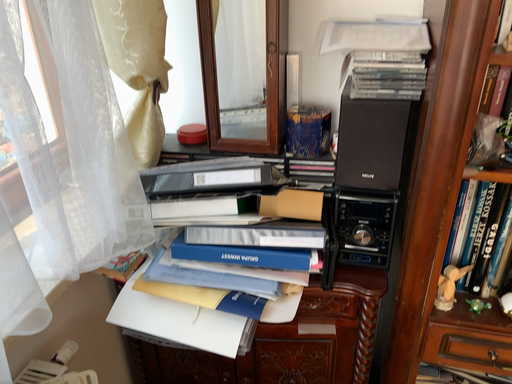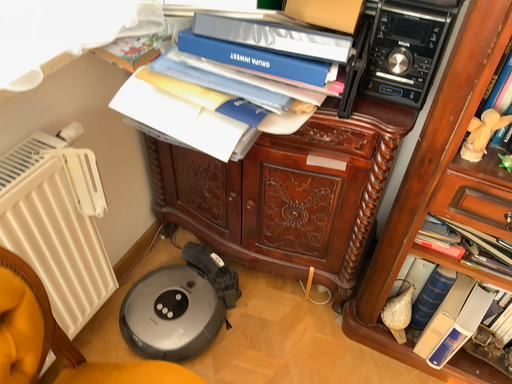
Question: How did the camera likely rotate when shooting the video?

Choices:
 (A) rotated left
 (B) rotated right

Answer: (A)